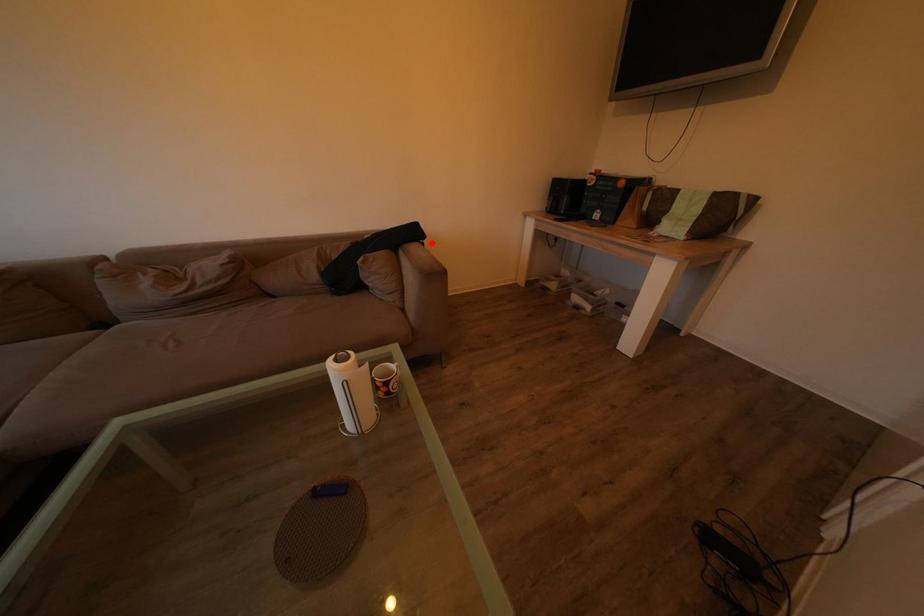
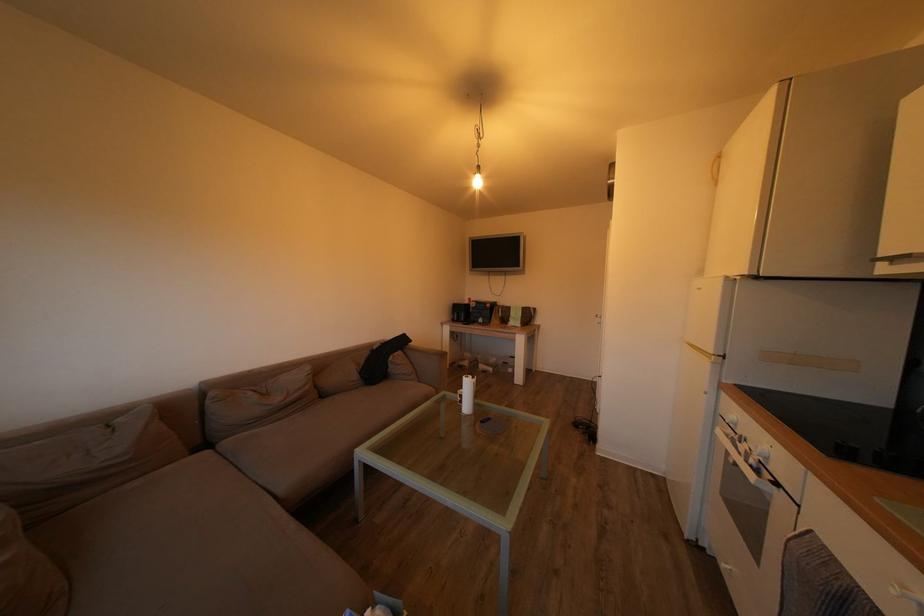
Where in the second image is the point corresponding to the highlighted location from the first image?

(419, 347)